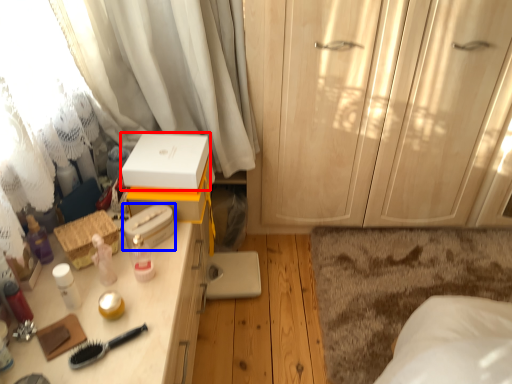
Question: Which object appears closest to the camera in this image, storage box (highlighted by a red box) or storage box (highlighted by a blue box)?

Choices:
 (A) storage box
 (B) storage box

Answer: (B)